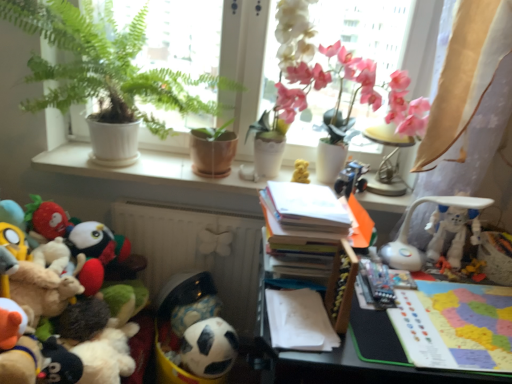
Where is `vacant space underneath white plastic robot at right, the 2th toy viewed from the right (from a real-world perspective)`? vacant space underneath white plastic robot at right, the 2th toy viewed from the right (from a real-world perspective) is located at coordinates (418, 279).